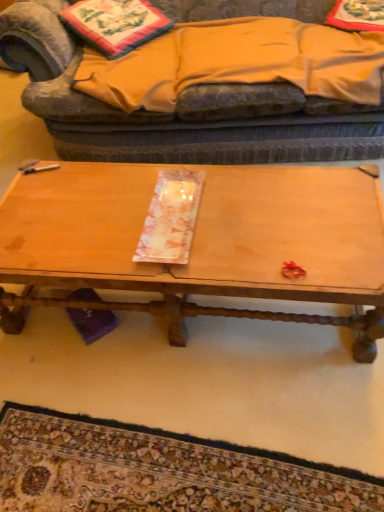
I want to click on blank space above wooden tray at center (from a real-world perspective), so click(x=182, y=212).